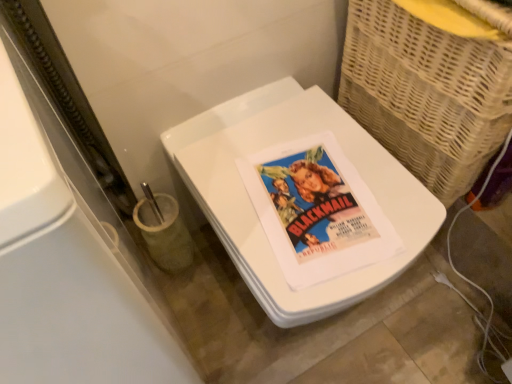
Locate an element on the screen. blank space situated above white glossy toilet at center (from a real-world perspective) is located at coordinates (295, 176).